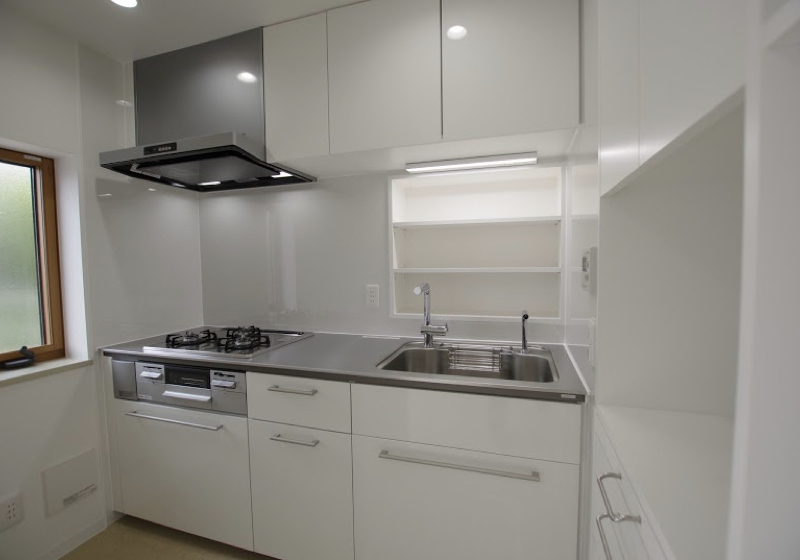
Find the location of a particular element. The height and width of the screenshot is (560, 800). cabinets is located at coordinates (170, 490), (474, 507), (264, 510), (594, 554).